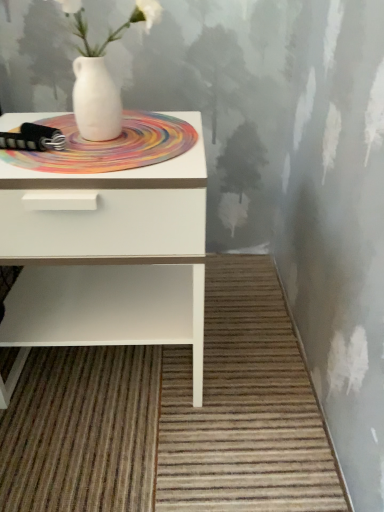
From the picture: What is the approximate width of white matte vase at upper center?

It is 7.12 inches.

This screenshot has height=512, width=384. In order to click on white glossy nightstand at left in this screenshot , I will do `click(107, 208)`.

Can you confirm if white matte vase at upper center is smaller than white glossy nightstand at left?

Yes.

Is white matte vase at upper center next to white glossy nightstand at left and touching it?

No, white matte vase at upper center is not beside white glossy nightstand at left.

This screenshot has width=384, height=512. In order to click on nightstand below the white matte vase at upper center (from the image's perspective) in this screenshot , I will do [x=107, y=208].

Consider the image. Is multicolored woven mat at center wider than white matte vase at upper center?

Yes, multicolored woven mat at center is wider than white matte vase at upper center.

Is multicolored woven mat at center aimed at white matte vase at upper center?

No, multicolored woven mat at center is not turned towards white matte vase at upper center.

From the image's perspective, which is below, multicolored woven mat at center or white matte vase at upper center?

multicolored woven mat at center.

Could you tell me if white glossy nightstand at left is turned towards white matte vase at upper center?

No, white glossy nightstand at left is not aimed at white matte vase at upper center.

In the scene shown: Between white glossy nightstand at left and white matte vase at upper center, which one has more height?

white glossy nightstand at left.

Which is behind, white glossy nightstand at left or white matte vase at upper center?

white glossy nightstand at left is behind.

In terms of size, does white glossy nightstand at left appear bigger or smaller than white matte vase at upper center?

white glossy nightstand at left is bigger than white matte vase at upper center.

From the image's perspective, which is above, white matte vase at upper center or multicolored woven mat at center?

white matte vase at upper center is shown above in the image.

In the scene shown: Can you confirm if white matte vase at upper center is taller than multicolored woven mat at center?

Correct, white matte vase at upper center is much taller as multicolored woven mat at center.

Is point (121, 32) positioned before point (154, 120)?

No, it is behind (154, 120).

Which object is positioned more to the right, white matte vase at upper center or multicolored woven mat at center?

white matte vase at upper center.

From a real-world perspective, is multicolored woven mat at center on top of white glossy nightstand at left?

Yes, from a real-world perspective, multicolored woven mat at center is on top of white glossy nightstand at left.

Which is more to the left, multicolored woven mat at center or white glossy nightstand at left?

white glossy nightstand at left is more to the left.

From the image's perspective, is multicolored woven mat at center above or below white glossy nightstand at left?

Clearly, from the image's perspective, multicolored woven mat at center is above white glossy nightstand at left.

Considering the sizes of objects white glossy nightstand at left and multicolored woven mat at center in the image provided, who is thinner, white glossy nightstand at left or multicolored woven mat at center?

multicolored woven mat at center.

Is white glossy nightstand at left beside multicolored woven mat at center?

white glossy nightstand at left and multicolored woven mat at center are not in contact.

From a real-world perspective, between white glossy nightstand at left and multicolored woven mat at center, who is vertically higher?

multicolored woven mat at center is physically above.

Locate an element on the screen. This screenshot has width=384, height=512. floral arrangement above the white glossy nightstand at left (from the image's perspective) is located at coordinates (101, 73).

The width and height of the screenshot is (384, 512). I want to click on mat behind the white matte vase at upper center, so click(x=110, y=146).

Which object lies further to the anchor point white matte vase at upper center, multicolored woven mat at center or white glossy nightstand at left?

white glossy nightstand at left lies further to white matte vase at upper center than the other object.

Estimate the real-world distances between objects in this image. Which object is closer to white matte vase at upper center, white glossy nightstand at left or multicolored woven mat at center?

The object closer to white matte vase at upper center is multicolored woven mat at center.

Estimate the real-world distances between objects in this image. Which object is further from multicolored woven mat at center, white matte vase at upper center or white glossy nightstand at left?

white glossy nightstand at left lies further to multicolored woven mat at center than the other object.

Estimate the real-world distances between objects in this image. Which object is closer to white glossy nightstand at left, multicolored woven mat at center or white matte vase at upper center?

multicolored woven mat at center is positioned closer to the anchor white glossy nightstand at left.

Which object lies further to the anchor point multicolored woven mat at center, white glossy nightstand at left or white matte vase at upper center?

white glossy nightstand at left is further to multicolored woven mat at center.

Looking at this image, from the image, which object appears to be nearer to white glossy nightstand at left, white matte vase at upper center or multicolored woven mat at center?

multicolored woven mat at center.

Locate an element on the screen. Image resolution: width=384 pixels, height=512 pixels. mat that lies between white matte vase at upper center and white glossy nightstand at left from top to bottom is located at coordinates (110, 146).